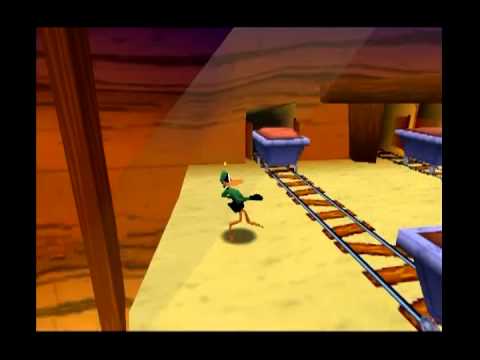
You are a GUI agent. You are given a task and a screenshot of the screen. Output one action in this format:
    pyautogui.click(x=<x>, y=<y>)
    Task: Click on the inside screen
    
    Given the screenshot: What is the action you would take?
    pyautogui.click(x=34, y=28), pyautogui.click(x=34, y=329), pyautogui.click(x=442, y=328), pyautogui.click(x=438, y=28)